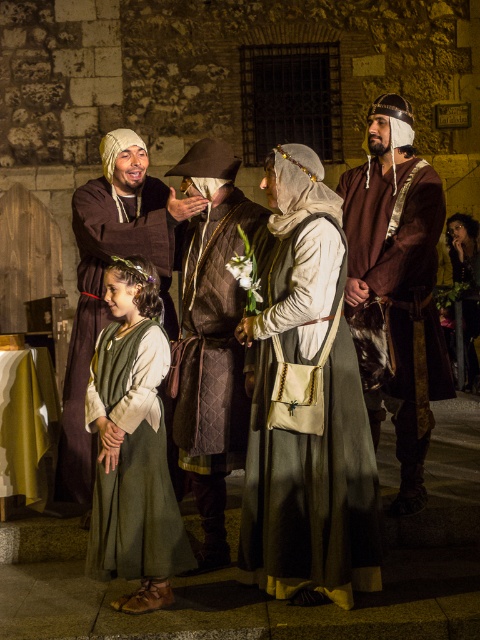
You are an archer in the medieval group. You need to aim at a target located at point (397, 284). What object is at that point?

The point (397, 284) is on the brown leather armor at right.